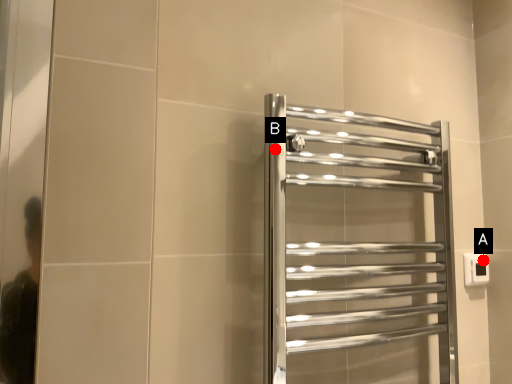
Question: Two points are circled on the image, labeled by A and B beside each circle. Among these points, which one is nearest to the camera?

Choices:
 (A) A is closer
 (B) B is closer

Answer: (B)